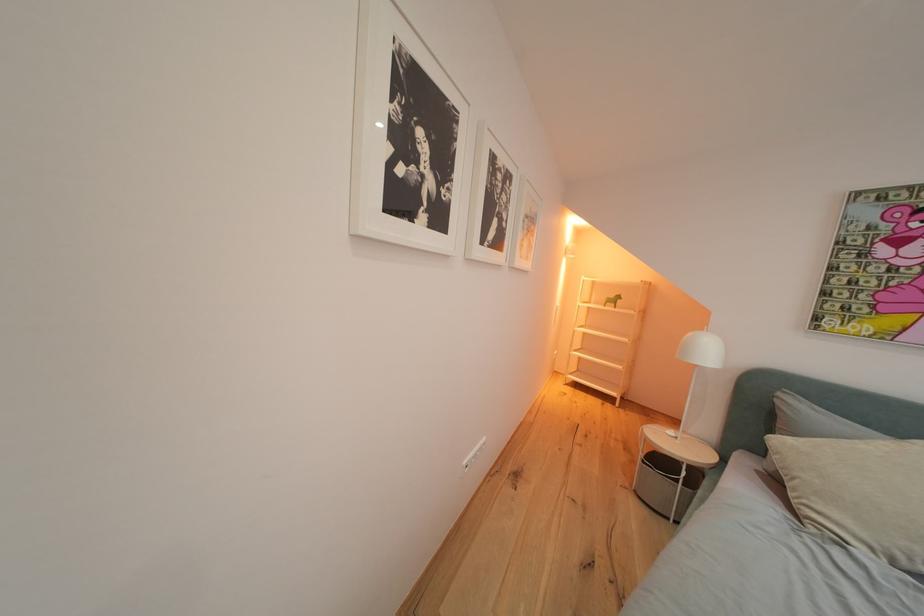
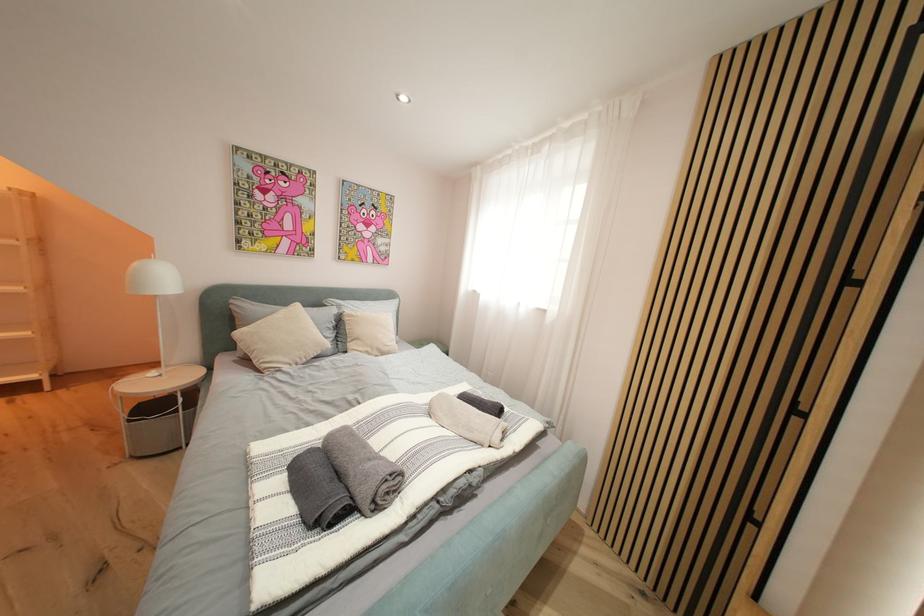
How did the camera likely rotate?

The camera's rotation is toward right-down.